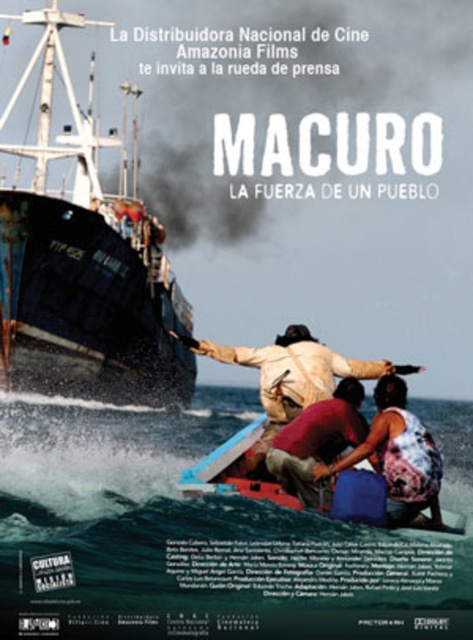
Where is the black matte ship at center located in the image?

The black matte ship at center is located at point coordinates of 0.406 and 0.180.